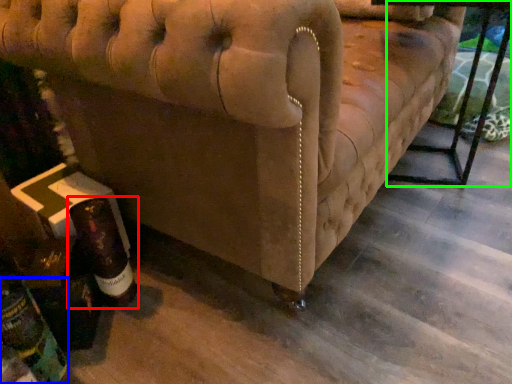
Question: Considering the real-world distances, which object is closest to bottle (highlighted by a red box)? bottle (highlighted by a blue box) or table (highlighted by a green box).

Choices:
 (A) bottle
 (B) table

Answer: (A)